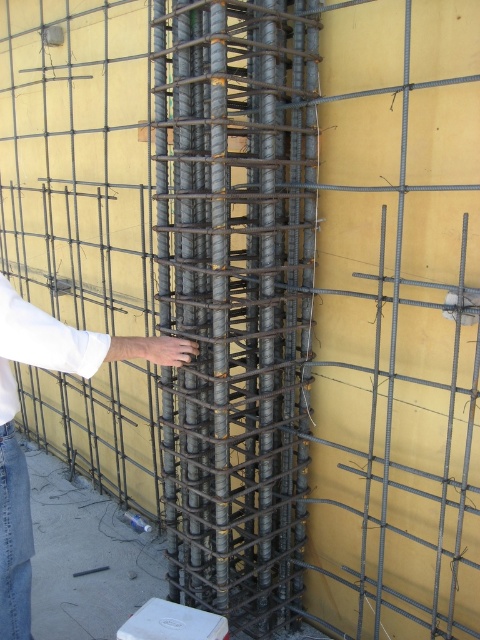
From the picture: Is white fabric hand at center wider than white cotton shirt at center?

Yes, white fabric hand at center is wider than white cotton shirt at center.

Is white fabric hand at center further to camera compared to white cotton shirt at center?

Yes, white fabric hand at center is behind white cotton shirt at center.

Which is in front, point (151, 349) or point (64, 356)?

Point (64, 356)

Locate an element on the screen. Image resolution: width=480 pixels, height=640 pixels. white fabric hand at center is located at coordinates (17, 410).

Can you confirm if gray metallic rebar at center is smaller than white cotton shirt at center?

No, gray metallic rebar at center is not smaller than white cotton shirt at center.

Does gray metallic rebar at center appear over white cotton shirt at center?

Correct, gray metallic rebar at center is located above white cotton shirt at center.

Which is in front, point (304, 524) or point (81, 371)?

Point (81, 371) is more forward.

I want to click on gray metallic rebar at center, so click(236, 298).

Is point (169, 472) farther from viewer compared to point (0, 433)?

Yes, point (169, 472) is farther from viewer.

Can you confirm if gray metallic rebar at center is positioned to the right of white fabric hand at center?

Yes, gray metallic rebar at center is to the right of white fabric hand at center.

At what (x,y) coordinates should I click in order to perform the action: click on gray metallic rebar at center. Please return your answer as a coordinate pair (x, y). This screenshot has height=640, width=480. Looking at the image, I should click on (236, 298).

The width and height of the screenshot is (480, 640). What are the coordinates of `gray metallic rebar at center` in the screenshot? It's located at (236, 298).